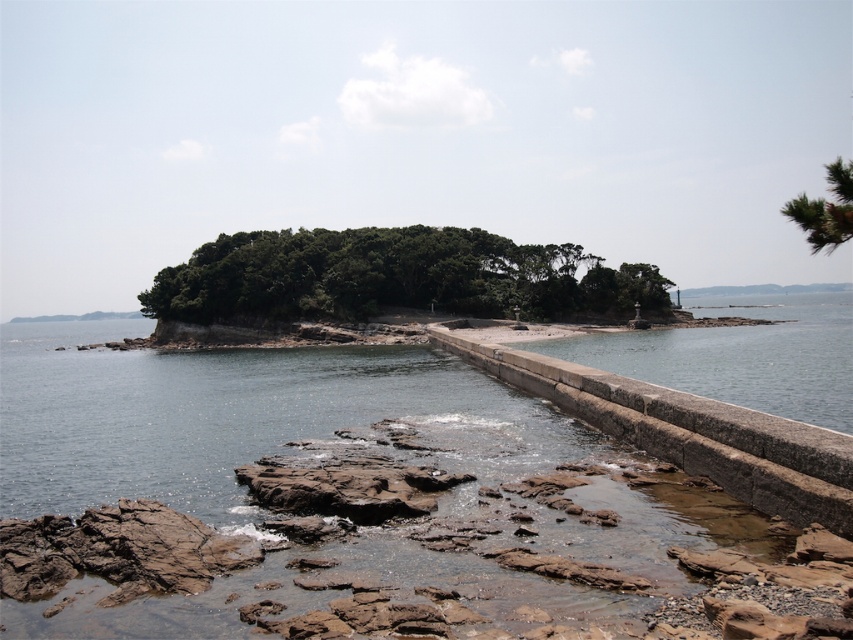
Consider the image. Is clear water at center thinner than green leafy island at center?

Incorrect, clear water at center's width is not less than green leafy island at center's.

Is clear water at center positioned behind green leafy island at center?

No, clear water at center is in front of green leafy island at center.

Is point (164, 480) more distant than point (222, 272)?

That is False.

Image resolution: width=853 pixels, height=640 pixels. Identify the location of clear water at center. (341, 490).

Is green leafy island at center to the left of green textured pine tree at upper right from the viewer's perspective?

Indeed, green leafy island at center is positioned on the left side of green textured pine tree at upper right.

Is point (340, 256) positioned before point (804, 221)?

No, it is not.

Locate an element on the screen. green leafy island at center is located at coordinates (392, 276).

Who is shorter, green leafy island at center or granite ledge at center?

Standing shorter between the two is granite ledge at center.

Where is `green leafy island at center`? green leafy island at center is located at coordinates (392, 276).

What are the coordinates of `green leafy island at center` in the screenshot? It's located at [392, 276].